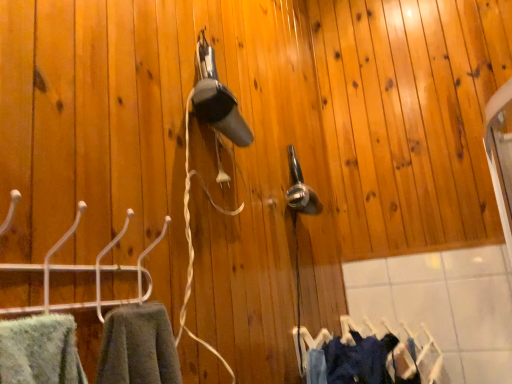
What do you see at coordinates (368, 357) in the screenshot? This screenshot has height=384, width=512. I see `denim fabric clothes at lower right` at bounding box center [368, 357].

Where is `denim fabric clothes at lower right`? The height and width of the screenshot is (384, 512). denim fabric clothes at lower right is located at coordinates (368, 357).

Does denim fabric clothes at lower right appear on the right side of white plastic hanger at left?

Yes.

Is denim fabric clothes at lower right oriented away from white plastic hanger at left?

No.

From a real-world perspective, who is located lower, denim fabric clothes at lower right or white plastic hanger at left?

denim fabric clothes at lower right.

In order to click on hanger located above the denim fabric clothes at lower right (from the image's perspective) in this screenshot , I will do `click(87, 271)`.

Considering the sizes of objects dark blue fabric at lower right and denim fabric clothes at lower right in the image provided, who is wider, dark blue fabric at lower right or denim fabric clothes at lower right?

With larger width is denim fabric clothes at lower right.

Locate an element on the screen. The image size is (512, 384). clothing that is on the left side of denim fabric clothes at lower right is located at coordinates (359, 360).

In terms of height, does dark blue fabric at lower right look taller or shorter compared to denim fabric clothes at lower right?

dark blue fabric at lower right is shorter than denim fabric clothes at lower right.

From the picture: Which of these two, dark blue fabric at lower right or white plastic hanger at left, is wider?

dark blue fabric at lower right.

Is dark blue fabric at lower right next to white plastic hanger at left?

No, dark blue fabric at lower right is not making contact with white plastic hanger at left.

From the image's perspective, would you say dark blue fabric at lower right is shown under white plastic hanger at left?

Indeed, from the image's perspective, dark blue fabric at lower right is shown beneath white plastic hanger at left.

From a real-world perspective, is white plastic hanger at left physically above dark blue fabric at lower right?

Yes, from a real-world perspective, white plastic hanger at left is on top of dark blue fabric at lower right.

Considering the positions of objects white plastic hanger at left and dark blue fabric at lower right in the image provided, who is more to the right, white plastic hanger at left or dark blue fabric at lower right?

dark blue fabric at lower right.

Which is behind, point (37, 267) or point (366, 362)?

The point (366, 362) is farther from the camera.

Identify the location of clothing located underneath the white plastic hanger at left (from a real-world perspective). (359, 360).

Would you consider denim fabric clothes at lower right to be distant from dark blue fabric at lower right?

No, denim fabric clothes at lower right is not far away from dark blue fabric at lower right.

Is denim fabric clothes at lower right at the right side of dark blue fabric at lower right?

Correct, you'll find denim fabric clothes at lower right to the right of dark blue fabric at lower right.

In order to click on laundry located below the dark blue fabric at lower right (from the image's perspective) in this screenshot , I will do `click(368, 357)`.

Which object is closer to the camera, denim fabric clothes at lower right or dark blue fabric at lower right?

dark blue fabric at lower right is in front.

From their relative heights in the image, would you say white plastic hanger at left is taller or shorter than denim fabric clothes at lower right?

Clearly, white plastic hanger at left is shorter compared to denim fabric clothes at lower right.

Considering the positions of objects white plastic hanger at left and denim fabric clothes at lower right in the image provided, who is more to the left, white plastic hanger at left or denim fabric clothes at lower right?

white plastic hanger at left is more to the left.

Is white plastic hanger at left oriented towards denim fabric clothes at lower right?

No, white plastic hanger at left is not turned towards denim fabric clothes at lower right.

Is point (102, 256) behind point (422, 358)?

No, it is in front of (422, 358).

Find the location of a particular element. The image size is (512, 384). hanger located above the denim fabric clothes at lower right (from a real-world perspective) is located at coordinates (87, 271).

Where is `laundry to the right of dark blue fabric at lower right`? The height and width of the screenshot is (384, 512). laundry to the right of dark blue fabric at lower right is located at coordinates (368, 357).

Looking at the image, which one is located closer to white plastic hanger at left, dark blue fabric at lower right or denim fabric clothes at lower right?

dark blue fabric at lower right is closer to white plastic hanger at left.

Based on the photo, based on their spatial positions, is white plastic hanger at left or dark blue fabric at lower right closer to denim fabric clothes at lower right?

dark blue fabric at lower right is closer to denim fabric clothes at lower right.

Considering their positions, is denim fabric clothes at lower right positioned further to white plastic hanger at left than dark blue fabric at lower right?

The object further to white plastic hanger at left is denim fabric clothes at lower right.

Looking at the image, which one is located closer to denim fabric clothes at lower right, dark blue fabric at lower right or white plastic hanger at left?

dark blue fabric at lower right is closer to denim fabric clothes at lower right.

Which object lies further to the anchor point dark blue fabric at lower right, denim fabric clothes at lower right or white plastic hanger at left?

white plastic hanger at left is positioned further to the anchor dark blue fabric at lower right.

Considering their positions, is white plastic hanger at left positioned closer to dark blue fabric at lower right than denim fabric clothes at lower right?

Based on the image, denim fabric clothes at lower right appears to be nearer to dark blue fabric at lower right.

The height and width of the screenshot is (384, 512). I want to click on clothing between white plastic hanger at left and denim fabric clothes at lower right from front to back, so click(359, 360).